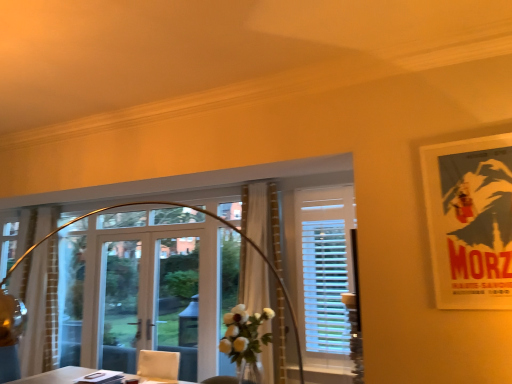
Question: Would you say transparent glass window at center, the 1th window when ordered from front to back, contains white sheer curtain at left, arranged as the 2th curtain when viewed from the front?

Choices:
 (A) no
 (B) yes

Answer: (A)

Question: Considering the relative positions of transparent glass window at center, acting as the 2th window starting from the right, and white sheer curtain at left, the 1th curtain positioned from the left, in the image provided, is transparent glass window at center, acting as the 2th window starting from the right, to the left of white sheer curtain at left, the 1th curtain positioned from the left, from the viewer's perspective?

Choices:
 (A) yes
 (B) no

Answer: (B)

Question: From the image's perspective, is transparent glass window at center, the second window when ordered from back to front, located above white sheer curtain at left, the 1th curtain positioned from the left?

Choices:
 (A) no
 (B) yes

Answer: (B)

Question: Is transparent glass window at center, the second window when ordered from back to front, turned away from white sheer curtain at left, arranged as the 2th curtain when viewed from the front?

Choices:
 (A) yes
 (B) no

Answer: (B)

Question: Can you confirm if transparent glass window at center, which is counted as the first window, starting from the left, is bigger than white sheer curtain at left, the second curtain positioned from the right?

Choices:
 (A) yes
 (B) no

Answer: (A)

Question: Is white sheer curtain at center, the second curtain in the left-to-right sequence, situated inside matte paper poster at upper right or outside?

Choices:
 (A) outside
 (B) inside

Answer: (A)

Question: From a real-world perspective, is white sheer curtain at center, the second curtain in the left-to-right sequence, above or below matte paper poster at upper right?

Choices:
 (A) above
 (B) below

Answer: (B)

Question: Is point (245, 254) positioned closer to the camera than point (463, 304)?

Choices:
 (A) closer
 (B) farther

Answer: (B)

Question: Based on their positions, is white sheer curtain at center, the 1th curtain positioned from the right, located to the left or right of matte paper poster at upper right?

Choices:
 (A) right
 (B) left

Answer: (B)

Question: Considering their positions, is white sheer curtain at center, acting as the 1th curtain starting from the front, located in front of or behind white sheer curtain at left, arranged as the 2th curtain when viewed from the front?

Choices:
 (A) behind
 (B) front

Answer: (B)

Question: Is point click(x=250, y=266) positioned closer to the camera than point click(x=56, y=342)?

Choices:
 (A) farther
 (B) closer

Answer: (B)

Question: In terms of height, does white sheer curtain at center, which appears as the second curtain when viewed from the back, look taller or shorter compared to white sheer curtain at left, positioned as the 1th curtain in back-to-front order?

Choices:
 (A) tall
 (B) short

Answer: (B)

Question: From a real-world perspective, relative to white sheer curtain at left, the second curtain positioned from the right, is white sheer curtain at center, the 1th curtain positioned from the right, vertically above or below?

Choices:
 (A) above
 (B) below

Answer: (A)

Question: Considering their positions, is clear glass door at center located in front of or behind white sheer curtain at center, which appears as the second curtain when viewed from the back?

Choices:
 (A) front
 (B) behind

Answer: (B)

Question: From the image's perspective, is clear glass door at center positioned above or below white sheer curtain at center, which appears as the second curtain when viewed from the back?

Choices:
 (A) above
 (B) below

Answer: (B)